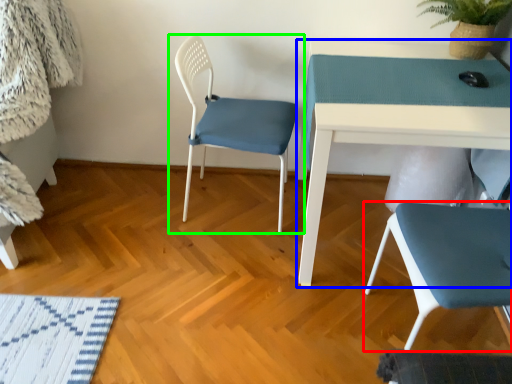
Question: Estimate the real-world distances between objects in this image. Which object is closer to chair (highlighted by a red box), table (highlighted by a blue box) or chair (highlighted by a green box)?

Choices:
 (A) table
 (B) chair

Answer: (A)